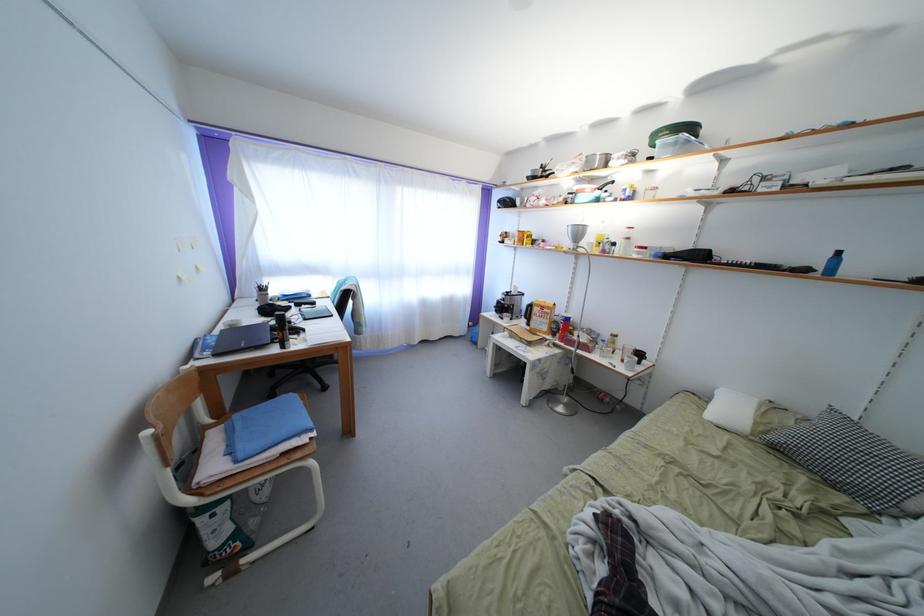
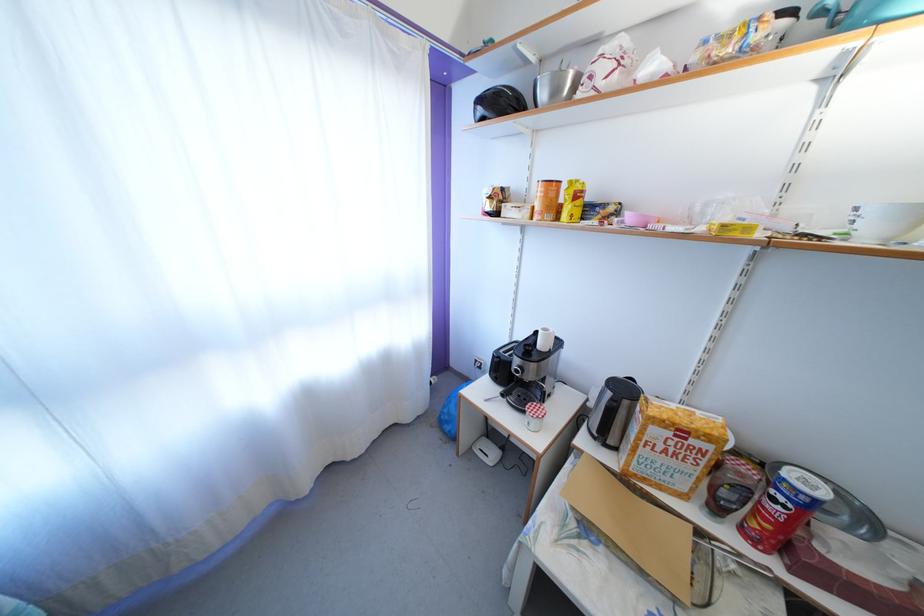
Find the pixel in the second image that matches pixel 549 310 in the first image.

(688, 428)